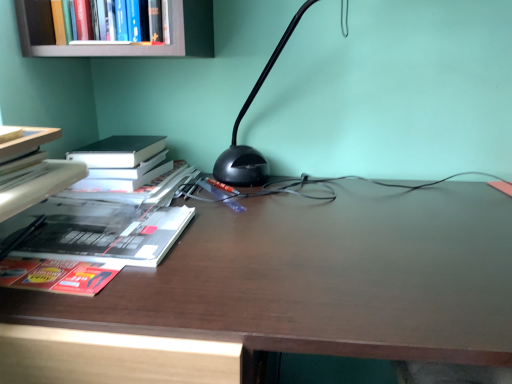
Locate an element on the screen. empty space that is to the right of hardcover book at left, placed as the first book when sorted from bottom to top is located at coordinates 248,255.